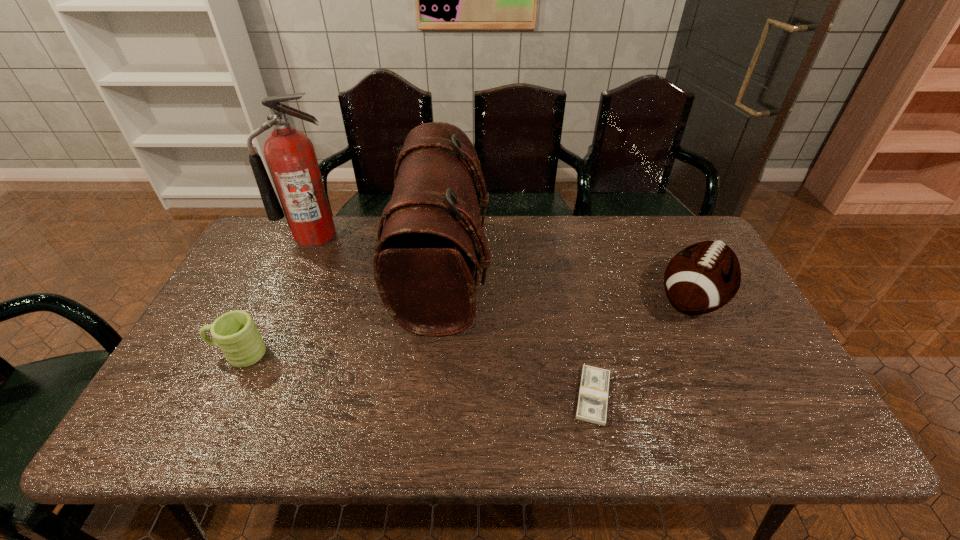
The height and width of the screenshot is (540, 960). What are the coordinates of `free region that satisfies the following two spatial constraints: 1. on the front of the football (American) near the operation label; 2. on the left side of the fire extinguisher` in the screenshot? It's located at (285, 301).

What are the coordinates of `vacant area that satisfies the following two spatial constraints: 1. on the front-facing side of the third object from right to left; 2. on the right side of the rightmost object` in the screenshot? It's located at (441, 301).